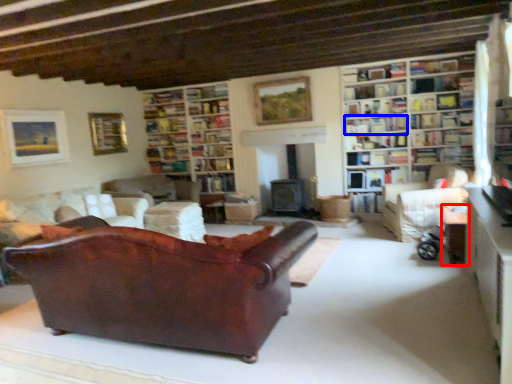
Question: Among these objects, which one is farthest to the camera, table (highlighted by a red box) or book (highlighted by a blue box)?

Choices:
 (A) table
 (B) book

Answer: (B)